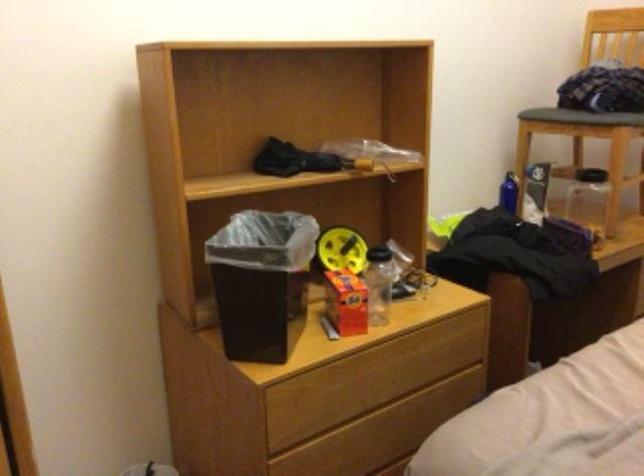
Question: Based on the continuous images, in which direction is the camera rotating? Reply with the corresponding letter.

Choices:
 (A) Left
 (B) Right
 (C) Up
 (D) Down

Answer: (B)